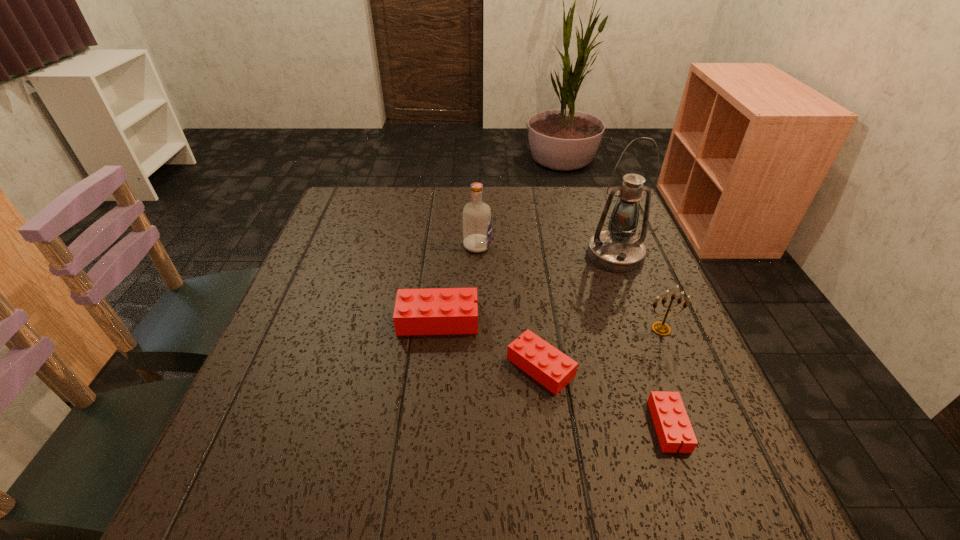
In order to click on vacant area that lies between the second nearest Lego and the oil lamp in this screenshot , I will do `click(578, 311)`.

The image size is (960, 540). I want to click on vacant area that lies between the tallest object and the third tallest object, so click(x=638, y=292).

Locate an element on the screen. This screenshot has height=540, width=960. free space between the nearest Lego and the candelabrum is located at coordinates (665, 377).

Locate an element on the screen. vacant region between the shortest object and the second nearest object is located at coordinates (605, 396).

This screenshot has height=540, width=960. I want to click on unoccupied area between the oil lamp and the rightmost Lego, so [642, 340].

Find the location of a particular element. unoccupied area between the candelabrum and the tallest Lego is located at coordinates (549, 325).

Identify the location of object that is the fifth closest to the fifth shortest object. (670, 418).

Where is `object that is the second closest to the second nearest object`? object that is the second closest to the second nearest object is located at coordinates (670, 418).

Find the location of a particular element. This screenshot has width=960, height=540. the second closest Lego to the second shortest object is located at coordinates (670, 418).

Where is `Lego identified as the third closest to the third tallest object`? This screenshot has height=540, width=960. Lego identified as the third closest to the third tallest object is located at coordinates (438, 311).